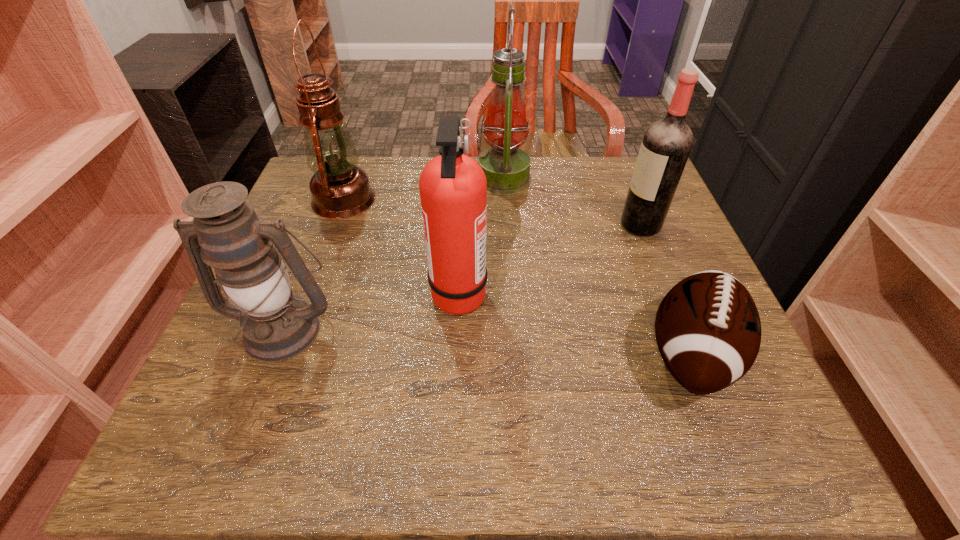
Where is `the third closest oil lamp to the shortest object`? the third closest oil lamp to the shortest object is located at coordinates (340, 189).

In order to click on vacant space that satisfies the following two spatial constraints: 1. on the handle side of the football (American); 2. on the right side of the fire extinguisher in this screenshot , I will do `click(456, 355)`.

This screenshot has height=540, width=960. I want to click on blank area in the image that satisfies the following two spatial constraints: 1. on the front-facing side of the liquor; 2. on the front side of the shortest object, so click(x=692, y=355).